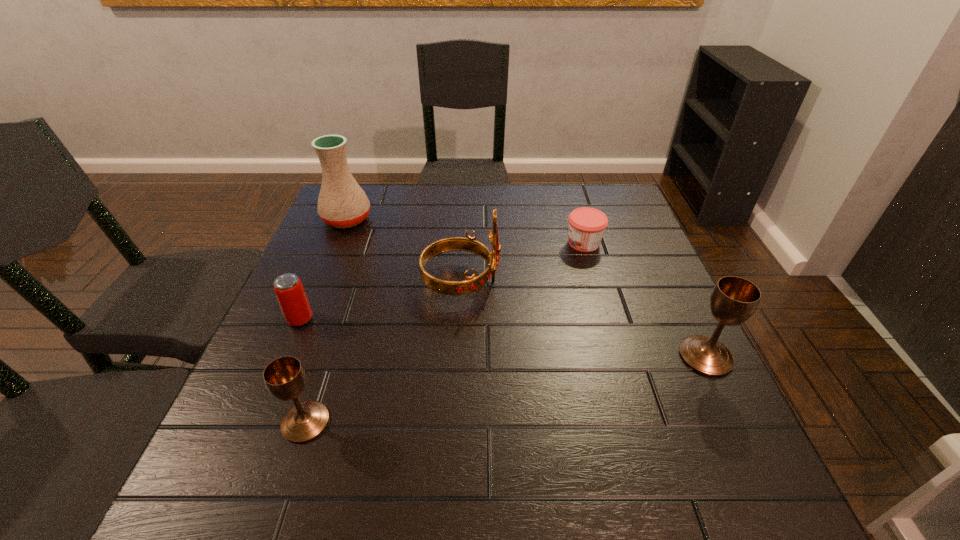
Image resolution: width=960 pixels, height=540 pixels. I want to click on location for an additional chalice to make spacing equal, so click(518, 387).